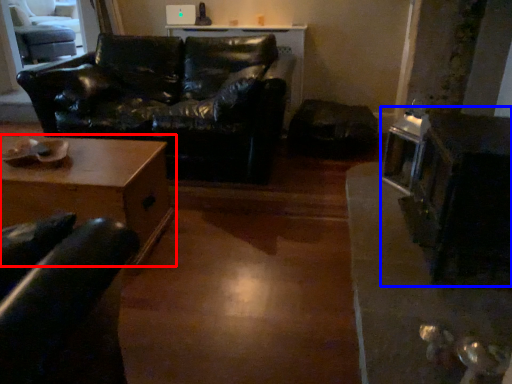
Question: Which of the following is the farthest to the observer, table (highlighted by a red box) or appliance (highlighted by a blue box)?

Choices:
 (A) table
 (B) appliance

Answer: (A)